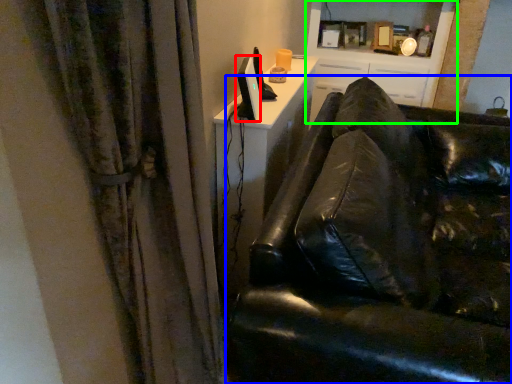
Question: Estimate the real-world distances between objects in this image. Which object is farther from computer monitor (highlighted by a red box), studio couch (highlighted by a blue box) or entertainment center (highlighted by a green box)?

Choices:
 (A) studio couch
 (B) entertainment center

Answer: (B)